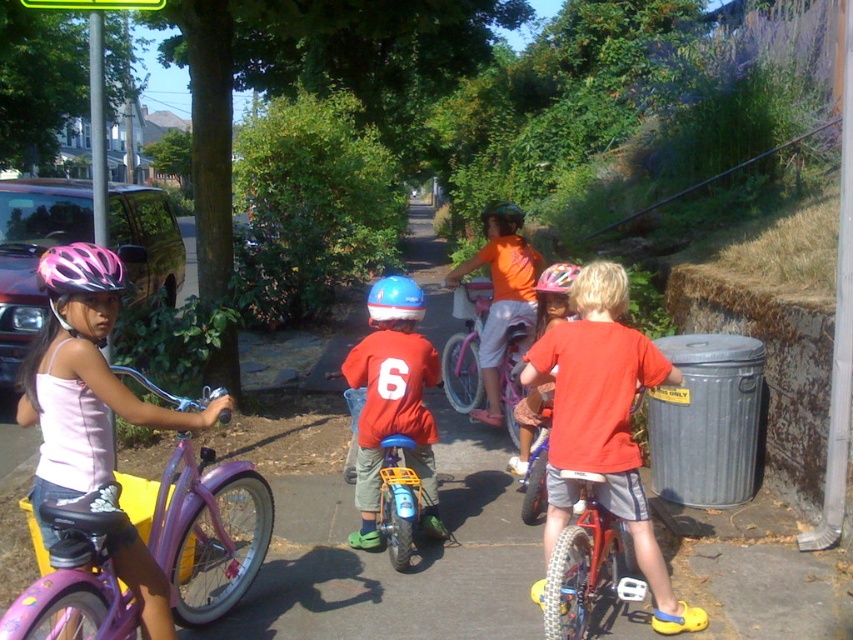
The height and width of the screenshot is (640, 853). What do you see at coordinates (604, 422) in the screenshot? I see `red matte shirt at right` at bounding box center [604, 422].

Which is above, red matte shirt at right or pink matte bicycle helmet at center?

pink matte bicycle helmet at center is above.

At what (x,y) coordinates should I click in order to perform the action: click on red matte shirt at right. Please return your answer as a coordinate pair (x, y). Image resolution: width=853 pixels, height=640 pixels. Looking at the image, I should click on (604, 422).

Who is shorter, matte red bicycle at center or blue matte helmet at center?

blue matte helmet at center

Does matte red bicycle at center have a smaller size compared to blue matte helmet at center?

Yes.

Where is `matte red bicycle at center`? Image resolution: width=853 pixels, height=640 pixels. matte red bicycle at center is located at coordinates (393, 401).

Find the location of a particular element. The image size is (853, 640). matte red bicycle at center is located at coordinates (393, 401).

Does red matte shirt at right have a larger size compared to orange cotton shirt at center?

Indeed, red matte shirt at right has a larger size compared to orange cotton shirt at center.

Does point (650, 385) come farther from viewer compared to point (520, 304)?

No, it is in front of (520, 304).

Image resolution: width=853 pixels, height=640 pixels. Identify the location of red matte shirt at right. (604, 422).